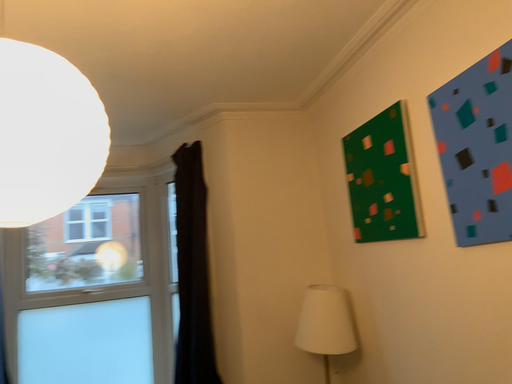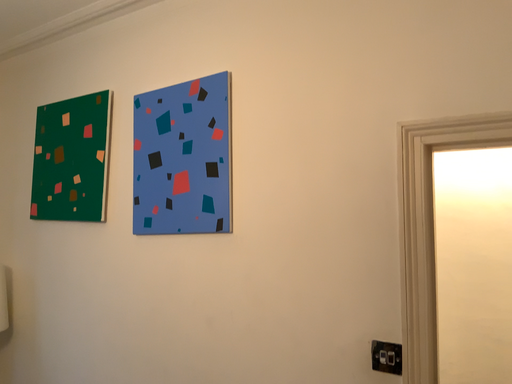
Question: How did the camera likely rotate when shooting the video?

Choices:
 (A) rotated left
 (B) rotated right

Answer: (B)